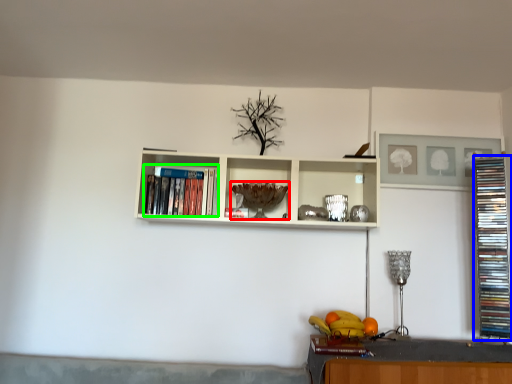
Question: Which object is the farthest from wine glass (highlighted by a red box)? Choose among these: book (highlighted by a blue box) or book (highlighted by a green box).

Choices:
 (A) book
 (B) book

Answer: (A)